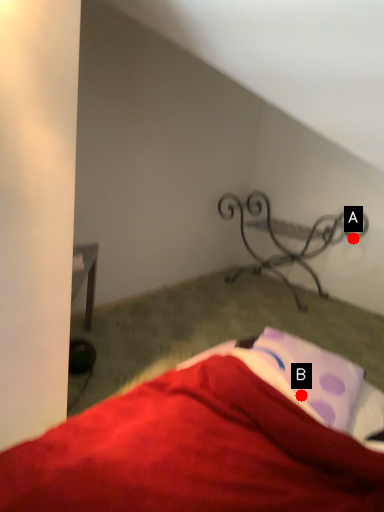
Question: Two points are circled on the image, labeled by A and B beside each circle. Among these points, which one is nearest to the camera?

Choices:
 (A) A is closer
 (B) B is closer

Answer: (B)